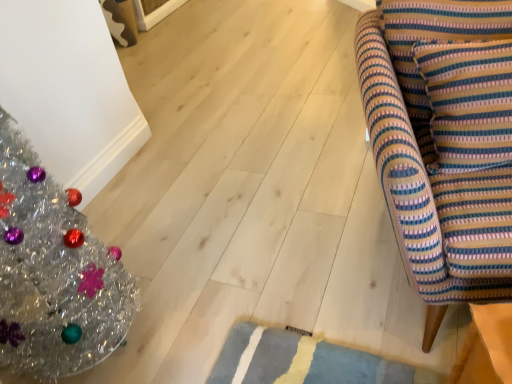
Question: From the image's perspective, is striped fabric armchair at right under striped fabric cushion at right?

Choices:
 (A) yes
 (B) no

Answer: (A)

Question: Is striped fabric armchair at right outside striped fabric cushion at right?

Choices:
 (A) no
 (B) yes

Answer: (B)

Question: Can you confirm if striped fabric armchair at right is wider than striped fabric cushion at right?

Choices:
 (A) no
 (B) yes

Answer: (B)

Question: Is striped fabric armchair at right facing away from striped fabric cushion at right?

Choices:
 (A) no
 (B) yes

Answer: (B)

Question: Is striped fabric armchair at right bigger than striped fabric cushion at right?

Choices:
 (A) no
 (B) yes

Answer: (B)

Question: Would you say striped fabric armchair at right is to the left or to the right of striped fabric cushion at right in the picture?

Choices:
 (A) left
 (B) right

Answer: (B)

Question: Is striped fabric armchair at right taller or shorter than striped fabric cushion at right?

Choices:
 (A) tall
 (B) short

Answer: (A)

Question: Looking at the image, does striped fabric armchair at right seem bigger or smaller compared to striped fabric cushion at right?

Choices:
 (A) small
 (B) big

Answer: (B)

Question: Relative to striped fabric cushion at right, is striped fabric armchair at right in front or behind?

Choices:
 (A) front
 (B) behind

Answer: (A)

Question: In the image, is shiny silver christmas tree at left on the left side or the right side of striped fabric cushion at right?

Choices:
 (A) left
 (B) right

Answer: (A)

Question: Looking at the image, does shiny silver christmas tree at left seem bigger or smaller compared to striped fabric cushion at right?

Choices:
 (A) big
 (B) small

Answer: (A)

Question: Considering the positions of shiny silver christmas tree at left and striped fabric cushion at right in the image, is shiny silver christmas tree at left wider or thinner than striped fabric cushion at right?

Choices:
 (A) wide
 (B) thin

Answer: (A)

Question: Considering the positions of point (109, 258) and point (413, 18), is point (109, 258) closer or farther from the camera than point (413, 18)?

Choices:
 (A) farther
 (B) closer

Answer: (A)

Question: Considering the positions of shiny silver christmas tree at left and striped fabric armchair at right in the image, is shiny silver christmas tree at left wider or thinner than striped fabric armchair at right?

Choices:
 (A) thin
 (B) wide

Answer: (A)

Question: Is shiny silver christmas tree at left taller or shorter than striped fabric armchair at right?

Choices:
 (A) short
 (B) tall

Answer: (B)